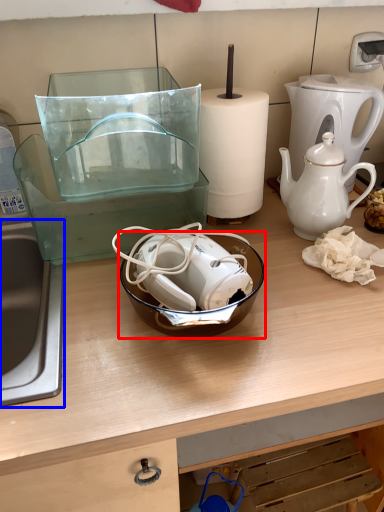
Question: Which object appears closest to the camera in this image, bowl (highlighted by a red box) or sink (highlighted by a blue box)?

Choices:
 (A) bowl
 (B) sink

Answer: (B)